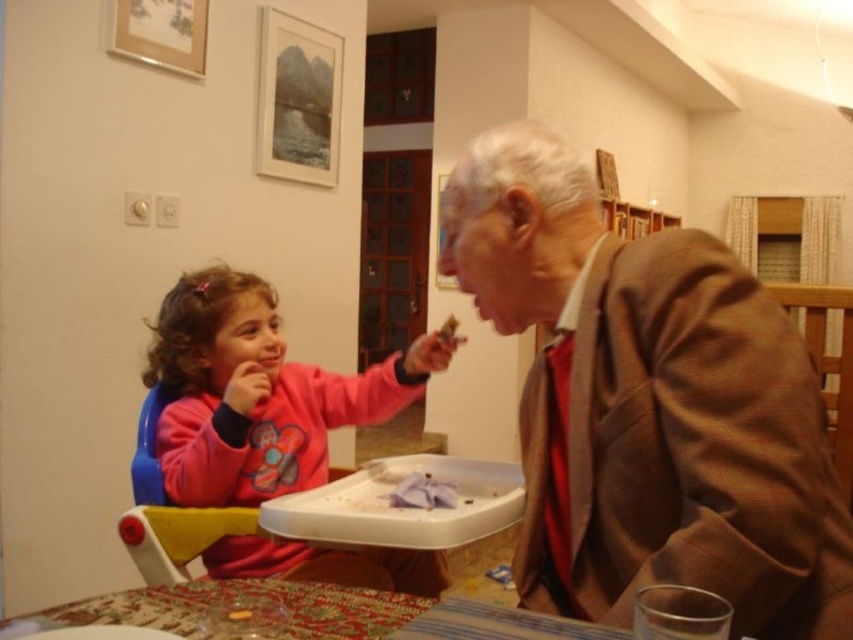
Looking at this image, you are a guest at a dinner party and need to choose seating. There is a brown textured suit at right and a yellow plastic chair at lower left. Which seat has more space for your legs?

The brown textured suit at right has more space for your legs since it is wider than the yellow plastic chair at lower left.

You are standing in the dining area and want to place a decorative plate between the two points marked as point [212,285] and point [167,531]. Which point should the plate be closer to in order to be closer to the viewer?

The plate should be closer to point [212,285] because it is further to the viewer than point [167,531].